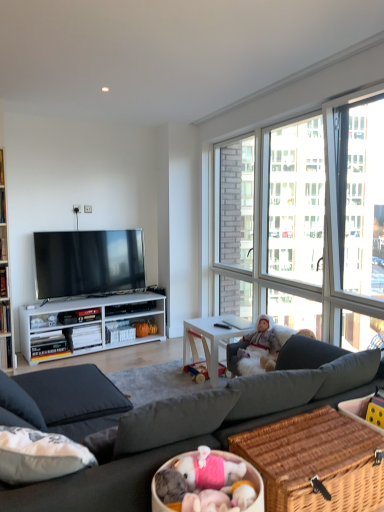
Question: Is white wood desk at center wider or thinner than white plush doll at center?

Choices:
 (A) thin
 (B) wide

Answer: (B)

Question: Is white wood desk at center taller or shorter than white plush doll at center?

Choices:
 (A) tall
 (B) short

Answer: (A)

Question: Which object is the farthest from the white wood desk at center?

Choices:
 (A) transparent glass window at upper right
 (B) woven brown picnic basket at lower right
 (C) matte black tv at center
 (D) white plush doll at center
 (E) dark gray fabric couch at center

Answer: (B)

Question: Estimate the real-world distances between objects in this image. Which object is closer to the matte black tv at center?

Choices:
 (A) dark gray fabric couch at center
 (B) white wood desk at center
 (C) woven brown picnic basket at lower right
 (D) transparent glass window at upper right
 (E) white plush doll at center

Answer: (A)